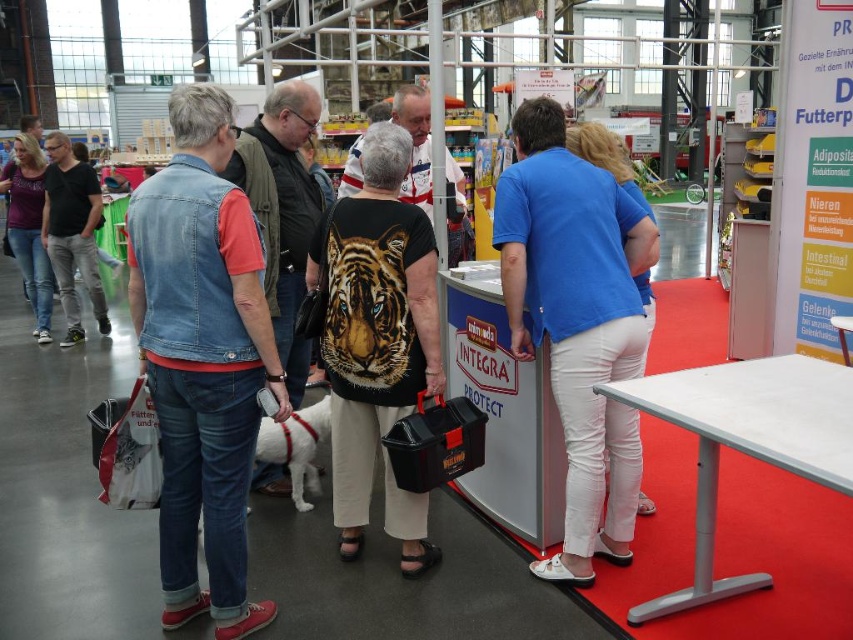
Which of these two, denim vest at left or matte purple shirt at left, stands taller?

matte purple shirt at left is taller.

Which is below, denim vest at left or matte purple shirt at left?

Positioned lower is denim vest at left.

In order to click on denim vest at left in this screenshot , I will do `click(202, 358)`.

Which is above, blue cotton shirt at center or dark gray jeans at left?

dark gray jeans at left

Measure the distance from blue cotton shirt at center to dark gray jeans at left.

blue cotton shirt at center and dark gray jeans at left are 5.05 meters apart from each other.

Describe the element at coordinates (577, 321) in the screenshot. The height and width of the screenshot is (640, 853). I see `blue cotton shirt at center` at that location.

Where is `blue cotton shirt at center`? The width and height of the screenshot is (853, 640). blue cotton shirt at center is located at coordinates (577, 321).

Does blue cotton shirt at center appear over denim jacket at left?

Actually, blue cotton shirt at center is below denim jacket at left.

Between point (573, 477) and point (273, 298), which one is positioned in front?

Point (573, 477) is more forward.

Who is more distant from viewer, (x=525, y=200) or (x=300, y=349)?

The point (x=300, y=349) is behind.

Where is `blue cotton shirt at center`? The height and width of the screenshot is (640, 853). blue cotton shirt at center is located at coordinates (577, 321).